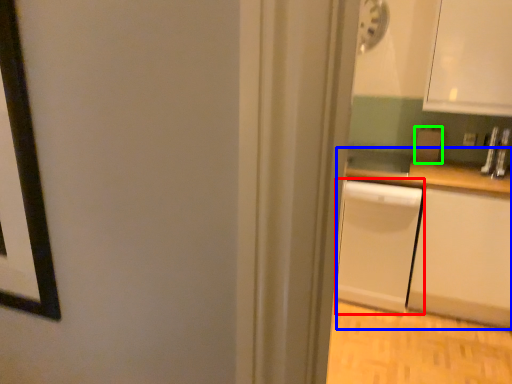
Question: Which object is positioned farthest from dish washer (highlighted by a red box)? Select from counter (highlighted by a blue box) and appliance (highlighted by a green box).

Choices:
 (A) counter
 (B) appliance

Answer: (B)